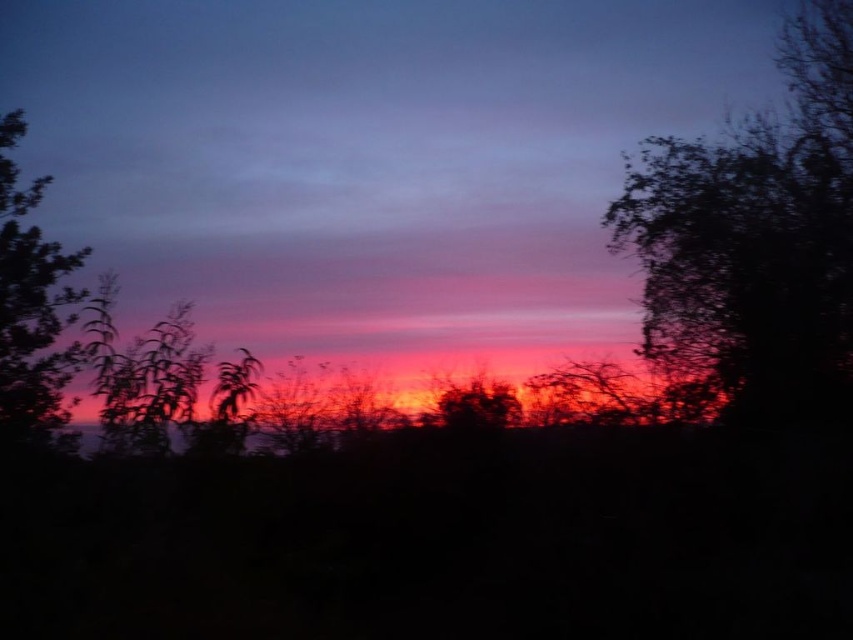
In the sunset scene, there are two elements in the foreground. One is the silhouette leafy tree at right and the other is the silky purple leaves at left. From the perspective of someone standing in front of the scene, which of these two elements is positioned to the left?

The silky purple leaves at left are positioned to the left of the silhouette leafy tree at right.

You are an artist sketching this sunset scene. You want to draw the silhouette leafy tree at right and the silky purple leaves at left accurately. Which object should you draw first to maintain proper spatial depth?

You should draw the silky purple leaves at left first because the silhouette leafy tree at right is closer to the viewer, so the leaves at left appear behind and should be sketched first to layer correctly.